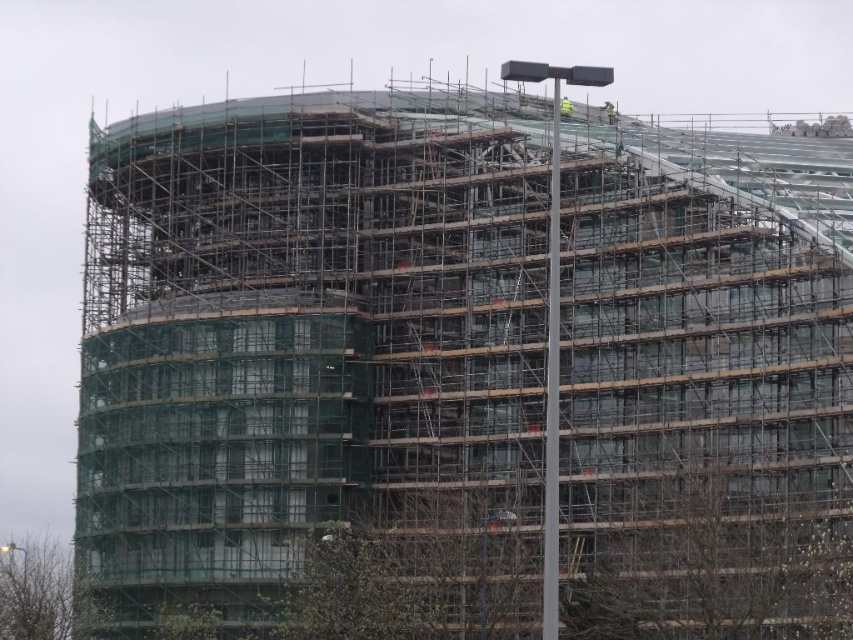
Question: Which point is farther to the camera?

Choices:
 (A) yellow reflective vest at upper center
 (B) green safety helmet at upper center

Answer: (A)

Question: Which point is farther from the camera taking this photo?

Choices:
 (A) (606, 109)
 (B) (564, 100)

Answer: (A)

Question: Can you confirm if green safety helmet at upper center is positioned to the left of yellow reflective vest at upper center?

Choices:
 (A) no
 (B) yes

Answer: (A)

Question: Is green safety helmet at upper center to the right of yellow reflective vest at upper center from the viewer's perspective?

Choices:
 (A) yes
 (B) no

Answer: (A)

Question: Can you confirm if green safety helmet at upper center is thinner than yellow reflective vest at upper center?

Choices:
 (A) no
 (B) yes

Answer: (A)